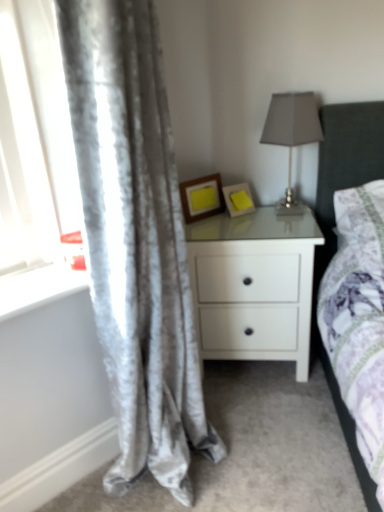
The image size is (384, 512). Identify the location of vacant area that lies in front of yellow matte picture frame at upper center, placed as the second picture frame when sorted from left to right. (246, 227).